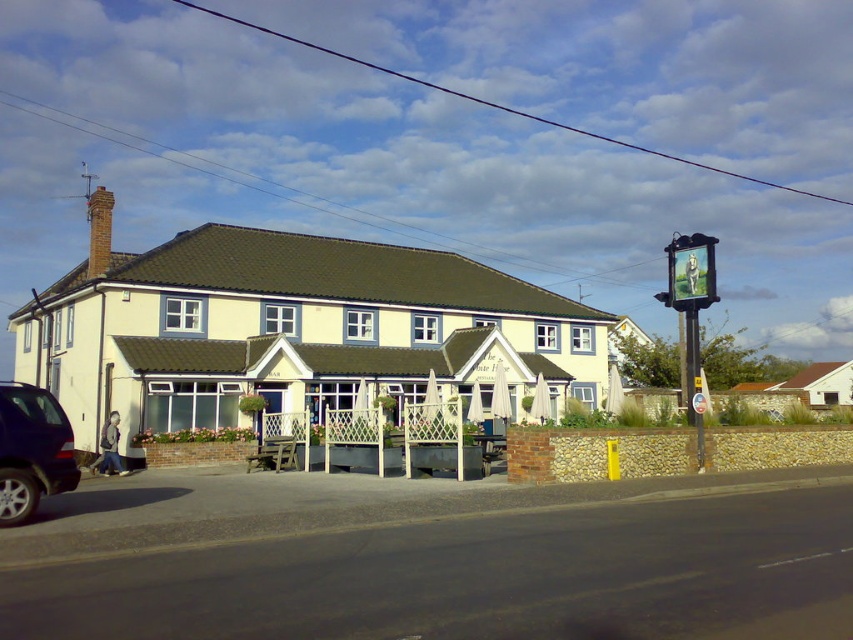
You are a delivery person arriving at the building and need to park your matte black suv at lower left near the entrance. However, there is a metallic signboard at upper right nearby. Can you park your vehicle there without hitting the signboard?

The matte black suv at lower left is positioned on the left side of metallic signboard at upper right, so parking the vehicle there would not interfere with the signboard as it is placed to the left of it.

You are a delivery person needing to park your motorcycle near the entrance of the pub. The entrance is located at the front of the building. The motorcycle requires a parking space that is at least 2 meters wide. Can you determine if the space between the matte black suv at lower left and the metallic signboard at upper right is wide enough for your motorcycle?

The distance between the matte black suv at lower left and the metallic signboard at upper right is 19.62 meters, which is more than sufficient for the motorcycle requiring 2 meters of space. Therefore, the space is wide enough for parking.